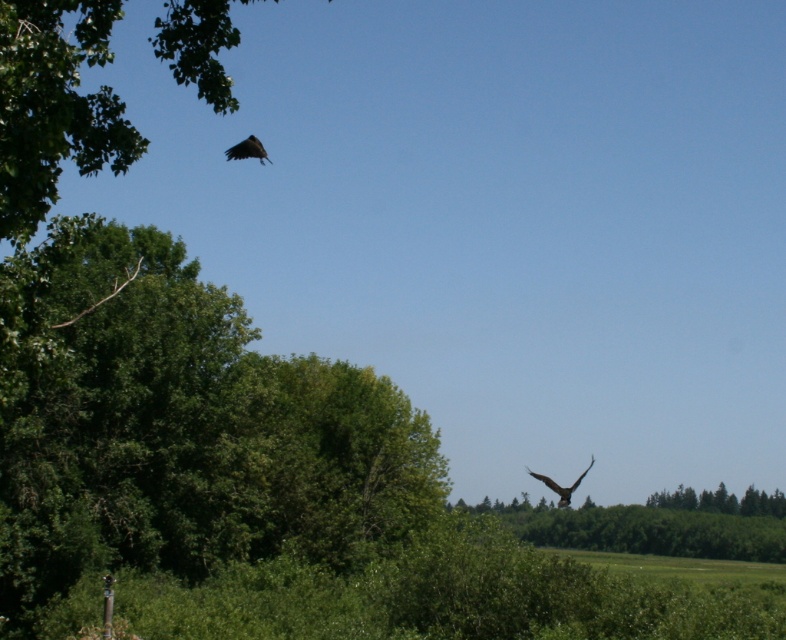
Can you confirm if green leafy tree at upper left is positioned above brown feathered eagle at lower right?

Correct, green leafy tree at upper left is located above brown feathered eagle at lower right.

Is point (8, 60) more distant than point (592, 460)?

No, it is in front of (592, 460).

Between point (54, 16) and point (556, 492), which one is positioned behind?

Positioned behind is point (556, 492).

Where is `green leafy tree at upper left`? green leafy tree at upper left is located at coordinates (54, 106).

Does green leafy tree at upper left have a larger size compared to dark brown eagle at upper left?

Yes, green leafy tree at upper left is bigger than dark brown eagle at upper left.

Who is more forward, (x=131, y=147) or (x=261, y=157)?

Positioned in front is point (x=131, y=147).

This screenshot has height=640, width=786. Find the location of `green leafy tree at upper left`. green leafy tree at upper left is located at coordinates (54, 106).

Is green leafy tree at upper left positioned before green leafy tree at lower right?

That is True.

Is the position of green leafy tree at upper left more distant than that of green leafy tree at lower right?

That is False.

The image size is (786, 640). I want to click on green leafy tree at upper left, so [54, 106].

This screenshot has height=640, width=786. In order to click on green leafy tree at upper left in this screenshot , I will do `click(54, 106)`.